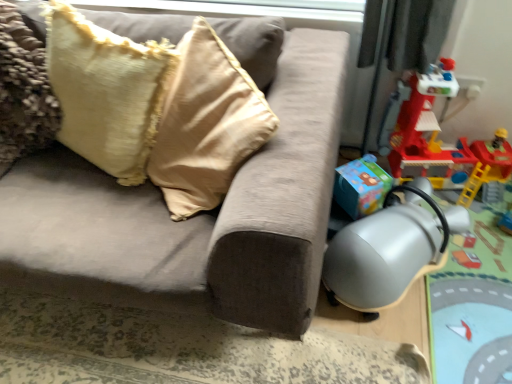
Question: Considering the positions of velvet beige pillow at upper left and silver metallic swivel chair at lower right in the image, is velvet beige pillow at upper left taller or shorter than silver metallic swivel chair at lower right?

Choices:
 (A) tall
 (B) short

Answer: (A)

Question: Considering the relative positions of velvet beige pillow at upper left and silver metallic swivel chair at lower right in the image provided, is velvet beige pillow at upper left to the left or to the right of silver metallic swivel chair at lower right?

Choices:
 (A) right
 (B) left

Answer: (B)

Question: Which is nearer to the rubberized red playset at right?

Choices:
 (A) velvet beige pillow at upper left
 (B) suede-like beige couch at center
 (C) silver metallic swivel chair at lower right

Answer: (C)

Question: Estimate the real-world distances between objects in this image. Which object is closer to the rubberized red playset at right?

Choices:
 (A) suede-like beige couch at center
 (B) velvet beige pillow at upper left
 (C) silver metallic swivel chair at lower right

Answer: (C)